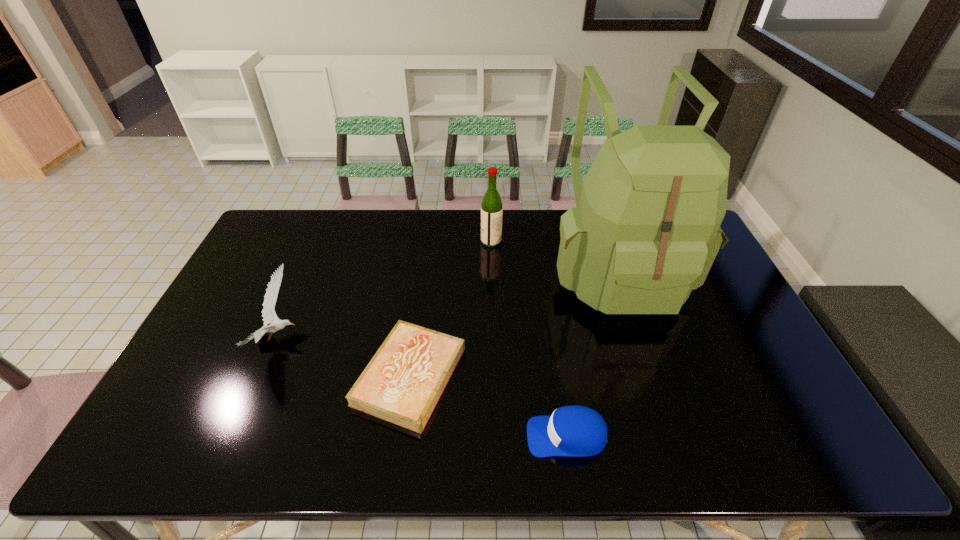
Image resolution: width=960 pixels, height=540 pixels. In order to click on vacant space that's between the liquor and the fourth tallest object in this screenshot , I will do `click(529, 339)`.

The height and width of the screenshot is (540, 960). I want to click on vacant point located between the shortest object and the baseball cap, so click(x=488, y=406).

Identify the location of vacant area that lies between the third object from right to left and the leftmost object. (385, 290).

Locate an element on the screen. The height and width of the screenshot is (540, 960). free point between the third shortest object and the tallest object is located at coordinates (447, 303).

You are a GUI agent. You are given a task and a screenshot of the screen. Output one action in this format:
    pyautogui.click(x=<x>, y=<y>)
    Task: Click on the free space between the fourth shortest object and the backpack
    The image size is (960, 540).
    Given the screenshot: What is the action you would take?
    pyautogui.click(x=554, y=255)

Identify the location of empty space between the liquor and the baseball cap. (529, 339).

Locate an element on the screen. This screenshot has width=960, height=540. free area in between the backpack and the baseball cap is located at coordinates (591, 352).

Find the location of a particular element. This screenshot has width=960, height=540. vacant space in between the third tallest object and the hardback book is located at coordinates (345, 357).

Identify the location of vacant area that lies between the second shortest object and the second object from left to right. The image size is (960, 540). (488, 406).

Identify the location of free area in between the third object from left to right and the leftmost object. The height and width of the screenshot is (540, 960). (385, 290).